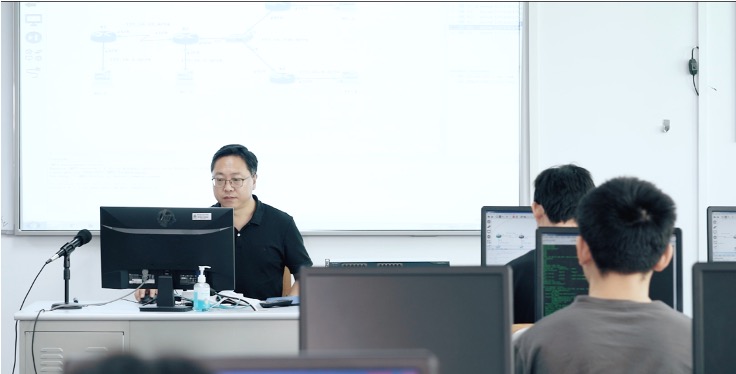
You are a GUI agent. You are given a task and a screenshot of the screen. Output one action in this format:
    pyautogui.click(x=<x>, y=<y>)
    Task: Click on the computer monitor
    The width and height of the screenshot is (736, 374).
    Given the screenshot: What is the action you would take?
    pyautogui.click(x=438, y=306), pyautogui.click(x=191, y=241), pyautogui.click(x=513, y=227), pyautogui.click(x=569, y=281), pyautogui.click(x=721, y=304), pyautogui.click(x=732, y=250)